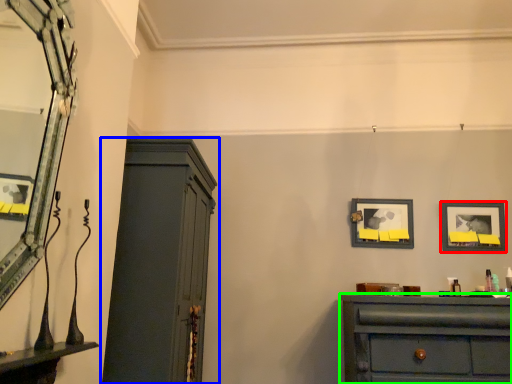
Question: Which object is positioned farthest from picture frame (highlighted by a red box)? Select from cupboard (highlighted by a blue box) and chest of drawers (highlighted by a green box).

Choices:
 (A) cupboard
 (B) chest of drawers

Answer: (A)